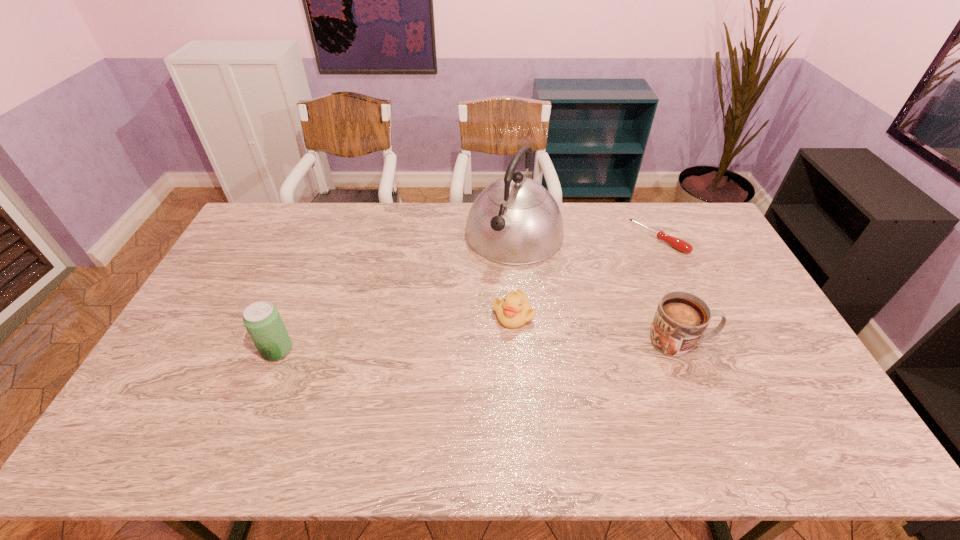
Image resolution: width=960 pixels, height=540 pixels. In order to click on vacant area located 0.350m at the tip of the shortest object in this screenshot , I will do `click(585, 300)`.

Locate an element on the screen. The height and width of the screenshot is (540, 960). free region located at the tip of the shortest object is located at coordinates (587, 298).

Where is `free point located 0.120m at the tip of the shortest object`? This screenshot has width=960, height=540. free point located 0.120m at the tip of the shortest object is located at coordinates (626, 266).

Image resolution: width=960 pixels, height=540 pixels. Find the location of `vacant area situated on the front-facing side of the second shortest object`. vacant area situated on the front-facing side of the second shortest object is located at coordinates (419, 368).

Identify the location of free spot located 0.280m on the front-facing side of the second shortest object. The image size is (960, 540). (415, 370).

Where is `vacant space located 0.220m on the front-facing side of the second shortest object`? This screenshot has height=540, width=960. vacant space located 0.220m on the front-facing side of the second shortest object is located at coordinates (434, 360).

The height and width of the screenshot is (540, 960). I want to click on kettle that is at the far edge, so click(516, 221).

Where is `screwdriver at the far edge`? screwdriver at the far edge is located at coordinates (679, 244).

This screenshot has height=540, width=960. In order to click on object that is at the right edge in this screenshot , I will do `click(679, 244)`.

Find the location of `object that is at the far right corner`. object that is at the far right corner is located at coordinates (679, 244).